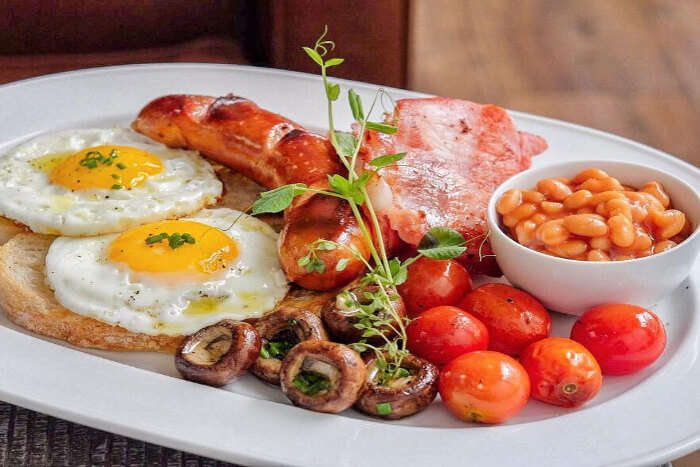
Where is `light gray rim of plate`? light gray rim of plate is located at coordinates (108, 407), (666, 422).